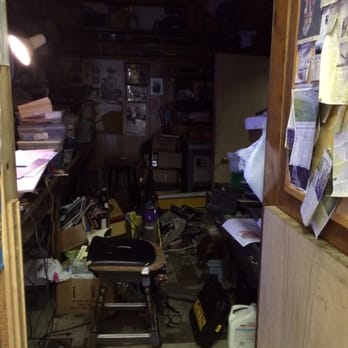
At what (x,y) coordinates should I click in order to perform the action: click on box. Please return your answer as a coordinate pair (x, y). Looking at the image, I should click on (64, 298), (74, 231).